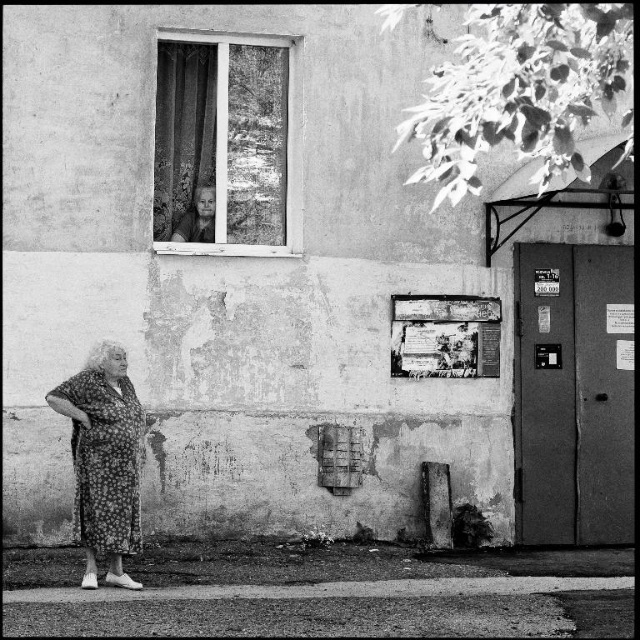
Where is `wooden frame window at upper center`? wooden frame window at upper center is located at coordinates (227, 145).

Which is behind, point (172, 218) or point (492, 593)?

The point (172, 218) is more distant.

Locate an element on the screen. This screenshot has height=640, width=640. wooden frame window at upper center is located at coordinates (227, 145).

Does wooden frame window at upper center appear on the right side of floral dress at lower left?

Indeed, wooden frame window at upper center is positioned on the right side of floral dress at lower left.

Is wooden frame window at upper center to the left of floral dress at lower left from the viewer's perspective?

In fact, wooden frame window at upper center is to the right of floral dress at lower left.

Find the location of a particular element. Image resolution: width=640 pixels, height=640 pixels. wooden frame window at upper center is located at coordinates (227, 145).

Locate an element on the screen. wooden frame window at upper center is located at coordinates (227, 145).

What do you see at coordinates (104, 460) in the screenshot?
I see `floral dress at lower left` at bounding box center [104, 460].

Who is more forward, (136, 532) or (202, 595)?

Point (202, 595) is in front.

The image size is (640, 640). Identify the location of floral dress at lower left. (104, 460).